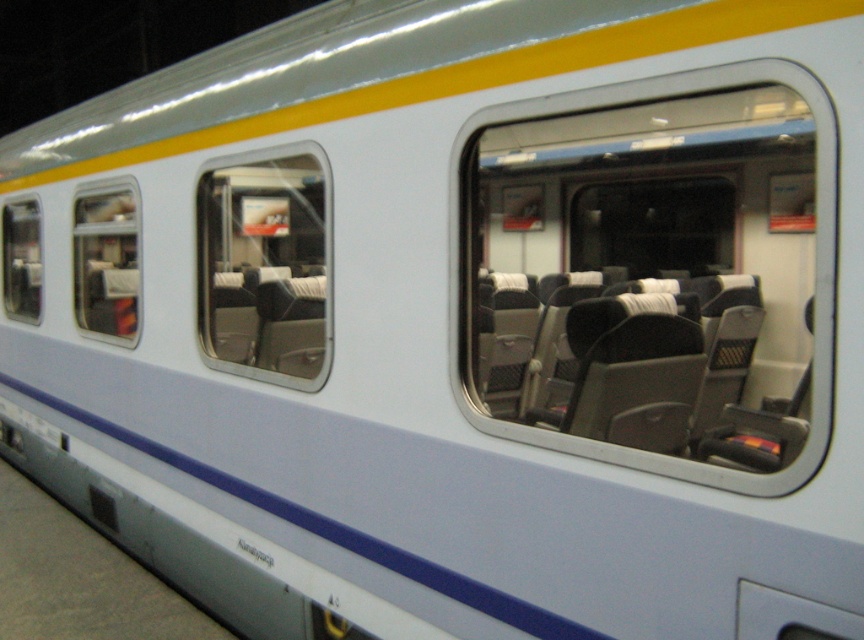
Which of these two, transparent glass window at center or clear glass window at left, stands taller?

transparent glass window at center is taller.

Which is behind, point (302, 161) or point (110, 336)?

The point (110, 336) is more distant.

Is point (316, 312) closer to camera compared to point (93, 240)?

Yes, point (316, 312) is closer to viewer.

Find the location of a particular element. transparent glass window at center is located at coordinates (264, 268).

Does clear glass window at center appear on the right side of transparent glass window at center?

Correct, you'll find clear glass window at center to the right of transparent glass window at center.

Is point (767, 317) positioned before point (207, 186)?

No, it is not.

This screenshot has height=640, width=864. Find the location of `clear glass window at center`. clear glass window at center is located at coordinates click(x=656, y=273).

Between point (677, 81) and point (18, 234), which one is positioned in front?

Positioned in front is point (677, 81).

Does clear glass window at center have a greater height compared to transparent glass window at left?

Yes, clear glass window at center is taller than transparent glass window at left.

Which is behind, point (497, 358) or point (24, 205)?

Point (24, 205)

Where is `clear glass window at center`? clear glass window at center is located at coordinates (656, 273).